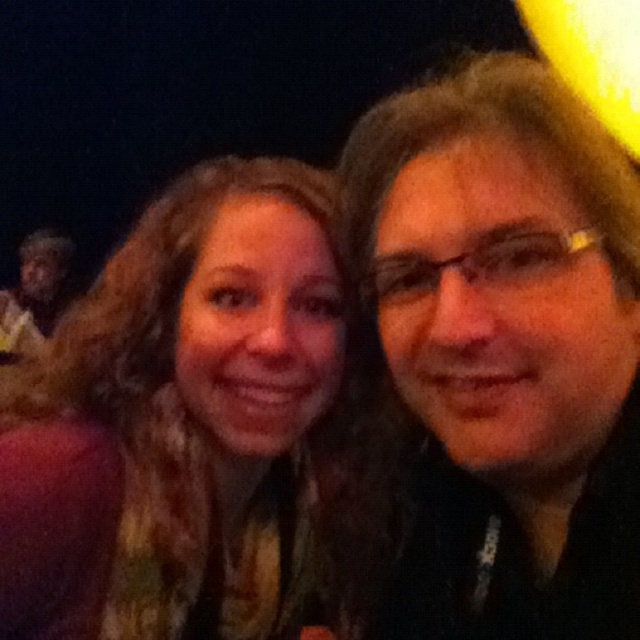
Question: Observing the image, what is the correct spatial positioning of matte black hair at center in reference to multicolored scarf at center?

Choices:
 (A) above
 (B) below

Answer: (A)

Question: Is multicolored scarf at center in front of dark skin face at left?

Choices:
 (A) no
 (B) yes

Answer: (B)

Question: Which of the following is the closest to the observer?

Choices:
 (A) dark skin face at left
 (B) multicolored scarf at center
 (C) matte black hair at center

Answer: (C)

Question: Which of the following is the farthest from the observer?

Choices:
 (A) (499, 508)
 (B) (61, 252)
 (C) (298, 280)

Answer: (B)

Question: Based on their relative distances, which object is farther from the dark skin face at left?

Choices:
 (A) multicolored scarf at center
 (B) matte black hair at center

Answer: (B)

Question: Is matte black hair at center further to the viewer compared to multicolored scarf at center?

Choices:
 (A) no
 (B) yes

Answer: (A)